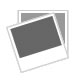
The width and height of the screenshot is (80, 80). I want to click on corner, so click(10, 29).